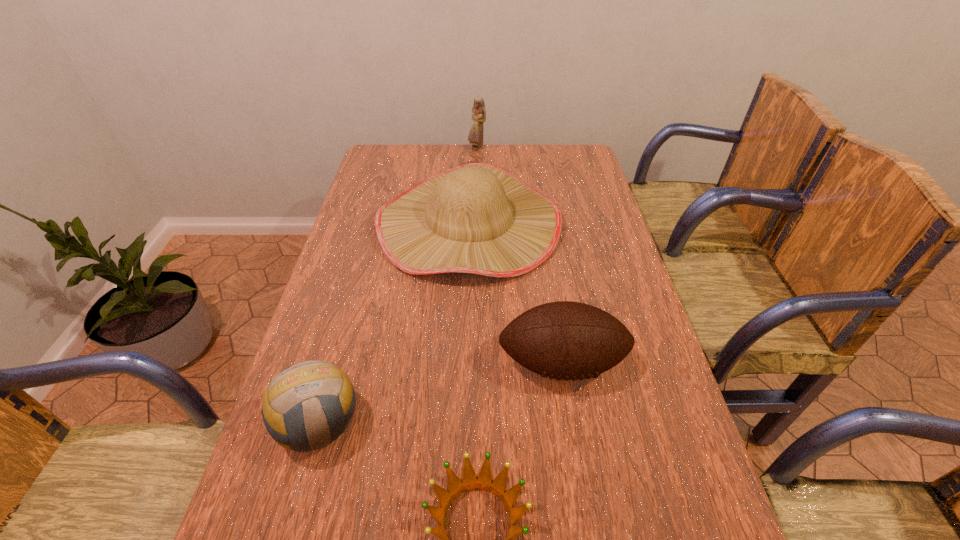
Where is `sunhat present at the left edge`? Image resolution: width=960 pixels, height=540 pixels. sunhat present at the left edge is located at coordinates (479, 218).

Locate an element on the screen. volleyball at the left edge is located at coordinates (292, 413).

Where is `object located in the right edge section of the desktop`? object located in the right edge section of the desktop is located at coordinates (564, 340).

Locate an element on the screen. The image size is (960, 540). object that is at the far left corner is located at coordinates (479, 218).

In the image, there is a desktop. What are the coordinates of `vacant space at the far edge` in the screenshot? It's located at (494, 147).

The image size is (960, 540). In the image, there is a desktop. Identify the location of free space at the left edge. (345, 325).

You are a GUI agent. You are given a task and a screenshot of the screen. Output one action in this format:
    pyautogui.click(x=<x>, y=<y>)
    Task: Click on the vacant space at the right edge
    This screenshot has height=540, width=960.
    Given the screenshot: What is the action you would take?
    pyautogui.click(x=579, y=189)

You are a GUI agent. You are given a task and a screenshot of the screen. Output one action in this format:
    pyautogui.click(x=<x>, y=<y>)
    Task: Click on the blank space at the far left corner
    This screenshot has height=540, width=960.
    Given the screenshot: What is the action you would take?
    pyautogui.click(x=405, y=153)

What are the coordinates of `free area in between the volleyball and the figurine` in the screenshot? It's located at (398, 286).

Where is `vacant space that is in between the volleyball and the figurine`? This screenshot has width=960, height=540. vacant space that is in between the volleyball and the figurine is located at coordinates (398, 286).